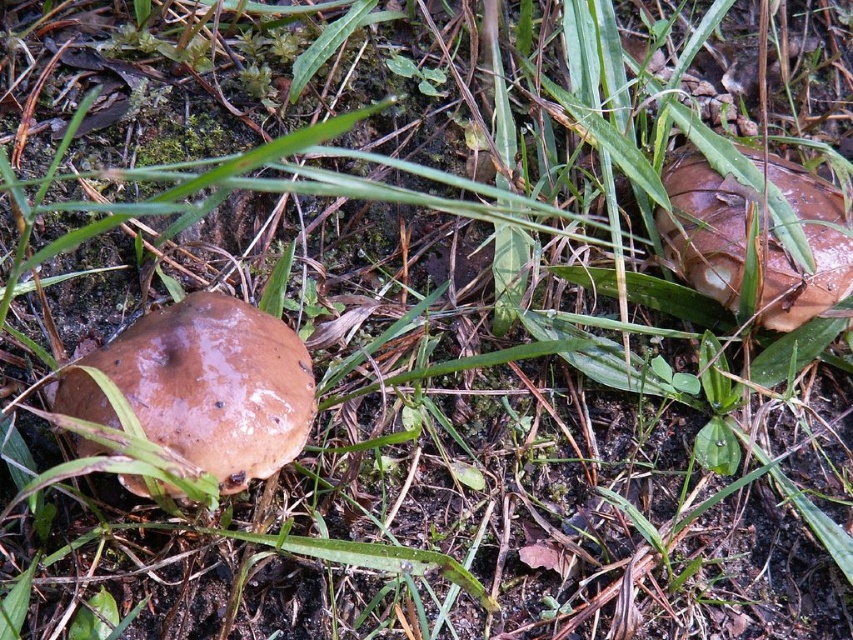
Question: Which of the following is the farthest from the observer?

Choices:
 (A) brown matte mushroom at right
 (B) brown matte mushroom at lower left

Answer: (A)

Question: Is brown matte mushroom at lower left smaller than brown matte mushroom at right?

Choices:
 (A) yes
 (B) no

Answer: (B)

Question: Is brown matte mushroom at lower left positioned in front of brown matte mushroom at right?

Choices:
 (A) no
 (B) yes

Answer: (B)

Question: Which point appears farthest from the camera in this image?

Choices:
 (A) (135, 476)
 (B) (822, 230)

Answer: (B)

Question: Can you confirm if brown matte mushroom at lower left is thinner than brown matte mushroom at right?

Choices:
 (A) yes
 (B) no

Answer: (B)